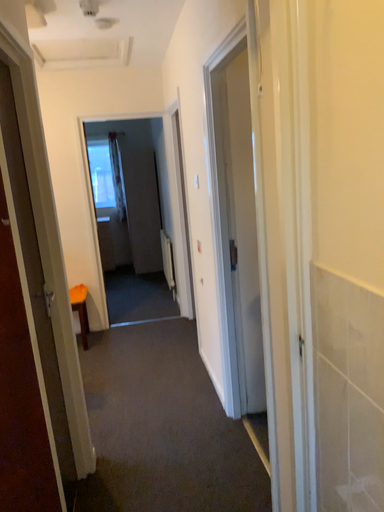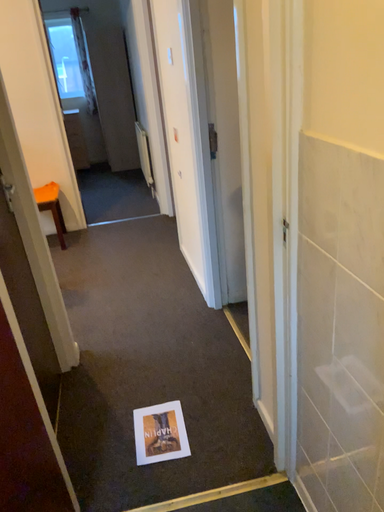
Question: Which way did the camera rotate in the video?

Choices:
 (A) rotated downward
 (B) rotated upward

Answer: (A)